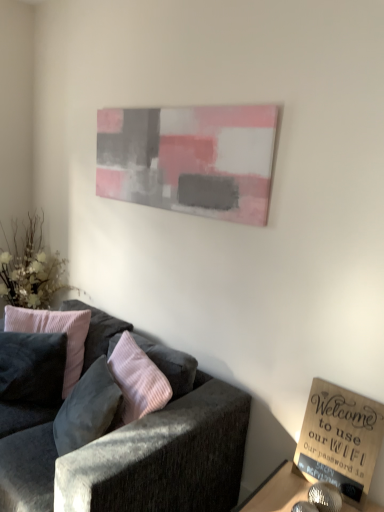
Question: Is point (261, 489) positioned closer to the camera than point (97, 377)?

Choices:
 (A) closer
 (B) farther

Answer: (A)

Question: Which is correct: wooden sign at lower right is inside velvet pink pillow at left, placed as the 1th pillow when sorted from right to left, or outside of it?

Choices:
 (A) outside
 (B) inside

Answer: (A)

Question: Considering the real-world distances, which object is farthest from the pink velvet pillow at left, acting as the first pillow starting from the left?

Choices:
 (A) wooden sign at lower right
 (B) wooden sign at lower right
 (C) velvet dark gray couch at lower left
 (D) painted canvas at upper center
 (E) white fabric floral arrangement at left

Answer: (A)

Question: Which object is positioned closest to the velvet pink pillow at left, which appears as the 2th pillow when viewed from the left?

Choices:
 (A) velvet dark gray couch at lower left
 (B) white fabric floral arrangement at left
 (C) wooden sign at lower right
 (D) wooden sign at lower right
 (E) pink velvet pillow at left, placed as the second pillow when sorted from right to left

Answer: (A)